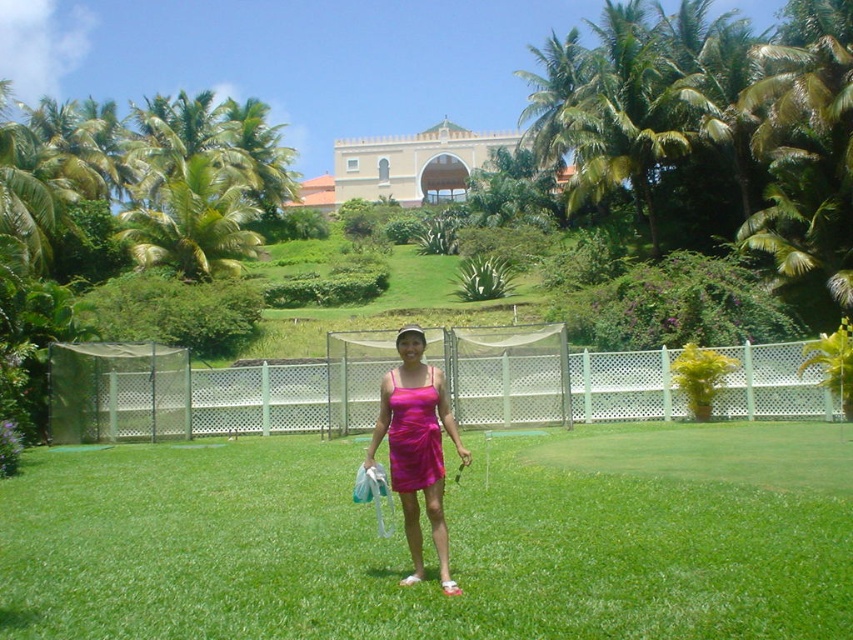
Does pink satin dress at center appear on the left side of shiny magenta dress at center?

In fact, pink satin dress at center is to the right of shiny magenta dress at center.

Is point (403, 397) farther from camera compared to point (402, 458)?

No, (403, 397) is closer to viewer.

What are the coordinates of `pink satin dress at center` in the screenshot? It's located at (416, 448).